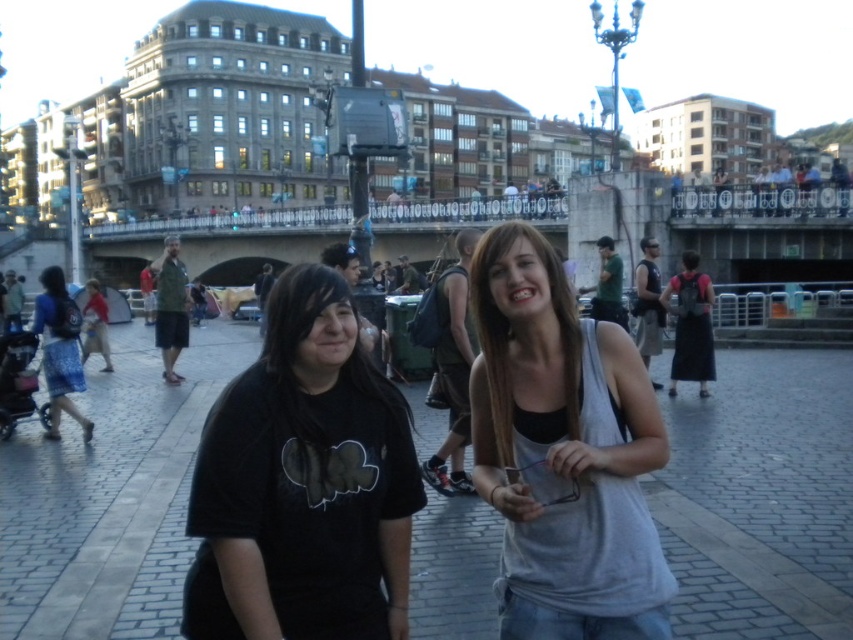
Question: Estimate the real-world distances between objects in this image. Which object is closer to the gray cotton tank top at center?

Choices:
 (A) blue denim skirt at left
 (B) black matte shirt at center

Answer: (B)

Question: Is gray cotton tank top at center further to the viewer compared to blue denim skirt at left?

Choices:
 (A) yes
 (B) no

Answer: (B)

Question: Which of the following is the farthest from the observer?

Choices:
 (A) gray cotton tank top at center
 (B) blue denim skirt at left

Answer: (B)

Question: Considering the real-world distances, which object is farthest from the blue denim skirt at left?

Choices:
 (A) gray cotton tank top at center
 (B) black matte shirt at center

Answer: (A)

Question: Does gray cotton tank top at center appear over blue denim skirt at left?

Choices:
 (A) yes
 (B) no

Answer: (B)

Question: Observing the image, what is the correct spatial positioning of black matte shirt at center in reference to gray cotton tank top at center?

Choices:
 (A) above
 (B) below

Answer: (B)